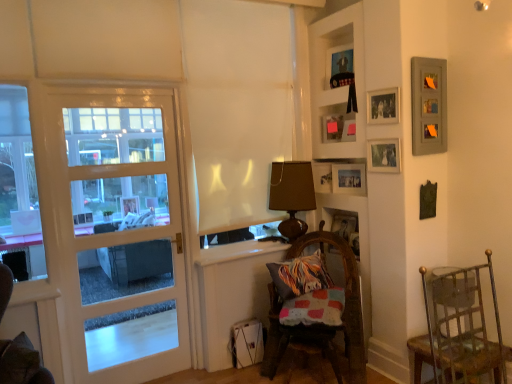
Question: Is matte wooden picture frame at upper center, which is counted as the 1th picture frame, starting from the top, surrounding wooden photo frame at upper right, positioned as the 5th picture frame in bottom-to-top order?

Choices:
 (A) no
 (B) yes

Answer: (A)

Question: From the image's perspective, would you say matte wooden picture frame at upper center, the 6th picture frame positioned from the bottom, is shown under wooden photo frame at upper right, positioned as the 5th picture frame in bottom-to-top order?

Choices:
 (A) yes
 (B) no

Answer: (B)

Question: From a real-world perspective, is matte wooden picture frame at upper center, which is counted as the 1th picture frame, starting from the top, located beneath wooden photo frame at upper right, positioned as the 5th picture frame in bottom-to-top order?

Choices:
 (A) no
 (B) yes

Answer: (A)

Question: Is matte wooden picture frame at upper center, the 6th picture frame positioned from the bottom, at the left side of wooden photo frame at upper right, which is counted as the second picture frame, starting from the top?

Choices:
 (A) yes
 (B) no

Answer: (A)

Question: From the image's perspective, is matte wooden picture frame at upper center, which is counted as the 1th picture frame, starting from the top, located above wooden photo frame at upper right, which is counted as the second picture frame, starting from the top?

Choices:
 (A) no
 (B) yes

Answer: (B)

Question: Would you say wooden picture frame at upper right, which is counted as the 4th picture frame, starting from the top, is to the left or to the right of white painted wood shelves at upper right in the picture?

Choices:
 (A) left
 (B) right

Answer: (B)

Question: From a real-world perspective, is wooden picture frame at upper right, which is counted as the 4th picture frame, starting from the top, physically located above or below white painted wood shelves at upper right?

Choices:
 (A) below
 (B) above

Answer: (A)

Question: Based on their sizes in the image, would you say wooden picture frame at upper right, which is counted as the 4th picture frame, starting from the top, is bigger or smaller than white painted wood shelves at upper right?

Choices:
 (A) big
 (B) small

Answer: (B)

Question: Relative to white painted wood shelves at upper right, is wooden picture frame at upper right, the 3th picture frame ordered from the bottom, in front or behind?

Choices:
 (A) front
 (B) behind

Answer: (A)

Question: From the image's perspective, is metallic silver picture frame at upper right, the fifth picture frame when ordered from top to bottom, above or below gray matte picture frame at upper right, the third picture frame when ordered from top to bottom?

Choices:
 (A) above
 (B) below

Answer: (B)

Question: Is metallic silver picture frame at upper right, the fifth picture frame when ordered from top to bottom, in front of or behind gray matte picture frame at upper right, which ranks as the fourth picture frame in bottom-to-top order, in the image?

Choices:
 (A) front
 (B) behind

Answer: (B)

Question: From a real-world perspective, is metallic silver picture frame at upper right, the 2th picture frame ordered from the bottom, positioned above or below gray matte picture frame at upper right, the third picture frame when ordered from top to bottom?

Choices:
 (A) below
 (B) above

Answer: (A)

Question: Would you say metallic silver picture frame at upper right, the 2th picture frame ordered from the bottom, is to the left or to the right of gray matte picture frame at upper right, the third picture frame when ordered from top to bottom, in the picture?

Choices:
 (A) left
 (B) right

Answer: (A)

Question: From a real-world perspective, is brown fabric lampshade at center above or below wooden photo frame at upper right, positioned as the 5th picture frame in bottom-to-top order?

Choices:
 (A) below
 (B) above

Answer: (A)

Question: Is brown fabric lampshade at center situated inside wooden photo frame at upper right, which is counted as the second picture frame, starting from the top, or outside?

Choices:
 (A) inside
 (B) outside

Answer: (B)